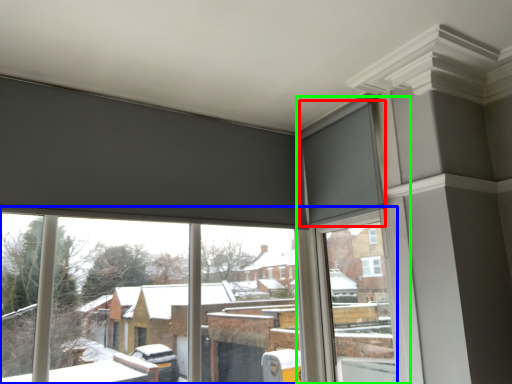
Question: Which object is positioned farthest from curtain (highlighted by a red box)? Select from window (highlighted by a blue box) and window frame (highlighted by a green box).

Choices:
 (A) window
 (B) window frame

Answer: (A)